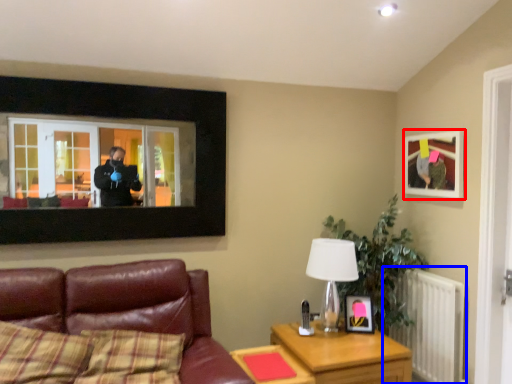
Question: Which of the following is the closest to the observer, picture frame (highlighted by a red box) or radiator (highlighted by a blue box)?

Choices:
 (A) picture frame
 (B) radiator

Answer: (B)